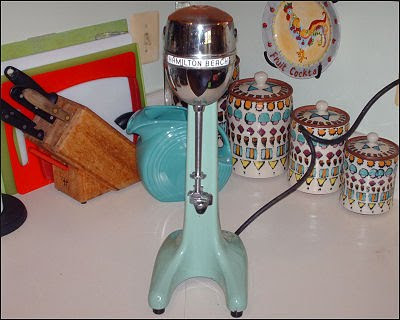
This screenshot has width=400, height=320. Identify the location of three matching jar set with lids. (365, 185), (297, 150), (250, 131).